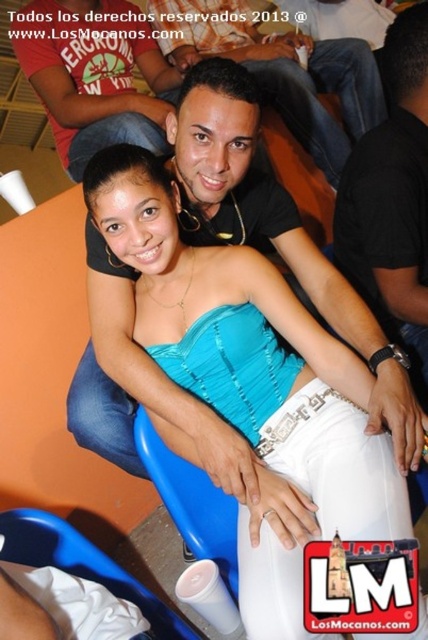
Question: Does teal satin strapless top at center have a smaller size compared to black matte shirt at upper center?

Choices:
 (A) no
 (B) yes

Answer: (A)

Question: Which of the following is the closest to the observer?

Choices:
 (A) (222, 333)
 (B) (413, 275)
 (C) (77, 564)

Answer: (A)

Question: Estimate the real-world distances between objects in this image. Which object is farther from the teal satin strapless top at center?

Choices:
 (A) matte black shirt at center
 (B) blue plastic chair at lower center

Answer: (A)

Question: Does black matte shirt at upper center appear on the right side of blue plastic chair at lower center?

Choices:
 (A) no
 (B) yes

Answer: (B)

Question: Which of the following is the closest to the observer?

Choices:
 (A) (162, 355)
 (B) (36, 529)
 (C) (395, 44)
 (D) (255, 72)

Answer: (A)

Question: Can you confirm if teal satin strapless top at center is positioned below blue plastic chair at lower center?

Choices:
 (A) yes
 (B) no

Answer: (B)